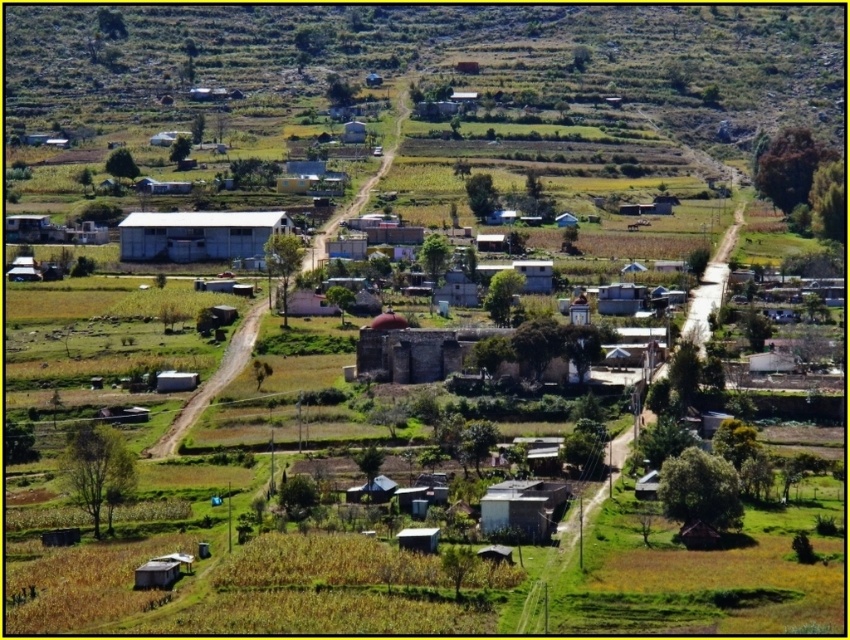
Does white corrugated metal building at center have a greater height compared to white matte hut at center?

Yes.

Is point (133, 234) positioned before point (531, 266)?

That is False.

Between point (273, 224) and point (525, 276), which one is positioned in front?

Positioned in front is point (525, 276).

This screenshot has width=850, height=640. What are the coordinates of `white corrugated metal building at center` in the screenshot? It's located at [197, 234].